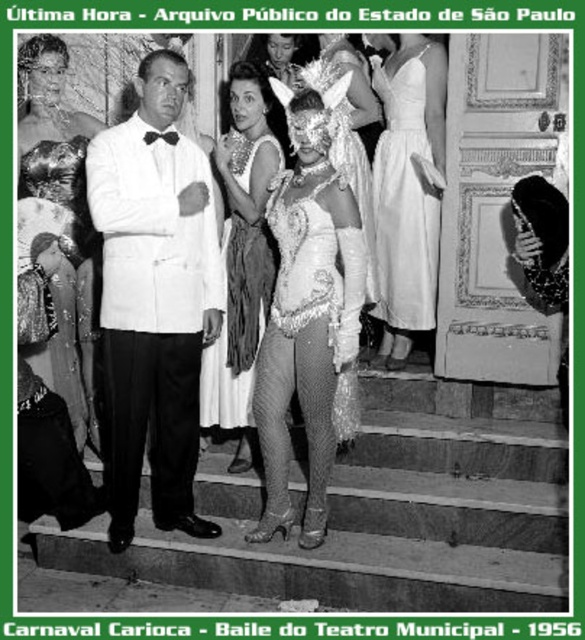
Question: Does white satin suit at center have a greater width compared to white satin dress at upper right?

Choices:
 (A) no
 (B) yes

Answer: (B)

Question: Does smooth stone stairs at center come in front of white satin dress at upper right?

Choices:
 (A) yes
 (B) no

Answer: (A)

Question: Estimate the real-world distances between objects in this image. Which object is closer to the shiny sequined dress at center?

Choices:
 (A) white satin dress at upper right
 (B) white satin suit at center

Answer: (B)

Question: Does white satin dress at upper right have a smaller size compared to shiny silver dress at center?

Choices:
 (A) no
 (B) yes

Answer: (B)

Question: Which point appears closest to the camera in this image?

Choices:
 (A) click(332, 305)
 (B) click(171, 198)
 (C) click(483, 448)
 (D) click(249, 396)

Answer: (B)

Question: Which of these objects is positioned farthest from the white satin suit at center?

Choices:
 (A) sequined fabric dress at left
 (B) white satin dress at upper right
 (C) shiny sequined dress at center
 (D) shiny silver dress at center

Answer: (B)